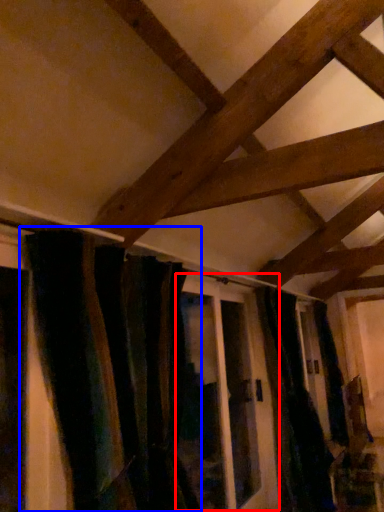
Question: Which of the following is the closest to the observer, screen door (highlighted by a red box) or curtain (highlighted by a blue box)?

Choices:
 (A) screen door
 (B) curtain

Answer: (B)